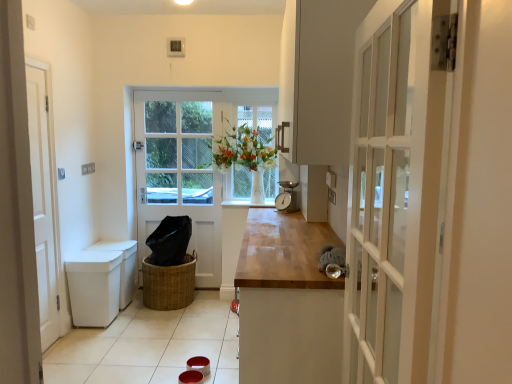
Question: Is clear glass window at center inside the boundaries of white wooden door at left, the first door from the front, or outside?

Choices:
 (A) inside
 (B) outside

Answer: (B)

Question: From a real-world perspective, is clear glass window at center above or below white wooden door at left, which ranks as the first door in left-to-right order?

Choices:
 (A) above
 (B) below

Answer: (A)

Question: Estimate the real-world distances between objects in this image. Which object is closer to the clear glass window at center?

Choices:
 (A) white glossy window sill at center
 (B) white plastic bin at lower left
 (C) white wooden door at center, marked as the first door in a right-to-left arrangement
 (D) woven brown basket at center
 (E) white wooden door at left, the second door viewed from the back

Answer: (C)

Question: Estimate the real-world distances between objects in this image. Which object is farther from the woven brown basket at center?

Choices:
 (A) white wooden door at center, placed as the second door when sorted from front to back
 (B) clear glass window at center
 (C) white glossy window sill at center
 (D) white plastic bin at lower left
 (E) metallic silver scale at center

Answer: (E)